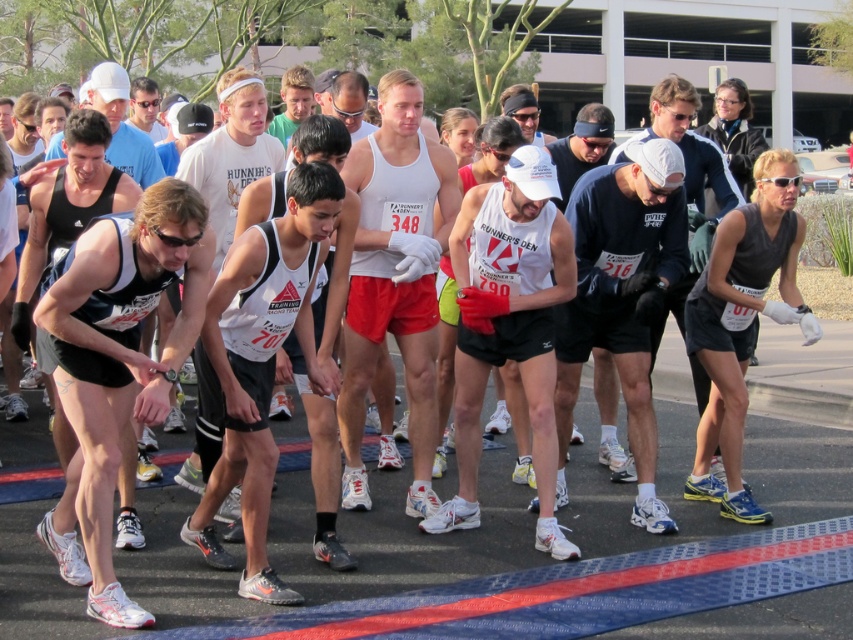
Question: Is dark blue fabric shirt at center further to camera compared to matte white tank top at center?

Choices:
 (A) no
 (B) yes

Answer: (A)

Question: Which point is closer to the camera?

Choices:
 (A) [660, 196]
 (B) [712, 368]
 (C) [51, 148]

Answer: (A)

Question: Is dark blue fabric shirt at center smaller than matte black tank top at center?

Choices:
 (A) no
 (B) yes

Answer: (A)

Question: Which point is farther to the camera?

Choices:
 (A) (740, 330)
 (B) (416, 417)
 (C) (618, 216)

Answer: (A)

Question: Is dark blue fabric shirt at center wider than matte white tank top at center?

Choices:
 (A) no
 (B) yes

Answer: (A)

Question: Which of the following is the farthest from the observer?

Choices:
 (A) (633, 451)
 (B) (509, 106)
 (C) (102, 104)
 (D) (709, 262)

Answer: (B)